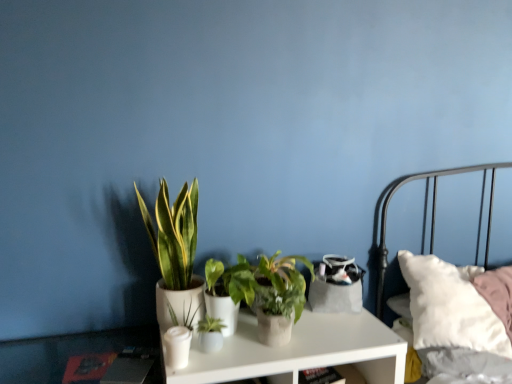
You are a GUI agent. You are given a task and a screenshot of the screen. Output one action in this format:
    pyautogui.click(x=<x>, y=<y>)
    Task: Click on the free point to the right of green matte plant at center, which ranks as the 3th houseplant in right-to-left order
    The image size is (512, 384).
    Given the screenshot: What is the action you would take?
    pyautogui.click(x=262, y=348)